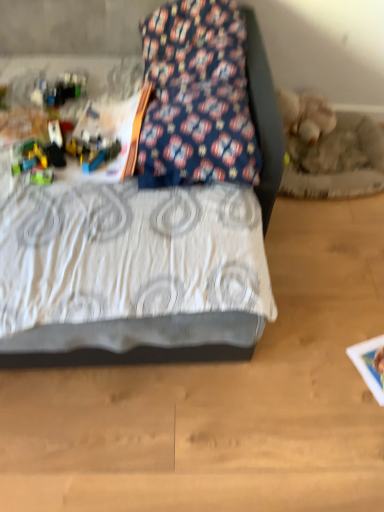
Question: Should I look upward or downward to see floral fabric pillow at upper center?

Choices:
 (A) up
 (B) down

Answer: (A)

Question: Is translucent plastic blocks at left bigger than floral fabric pillow at upper center?

Choices:
 (A) yes
 (B) no

Answer: (B)

Question: Is translucent plastic blocks at left with floral fabric pillow at upper center?

Choices:
 (A) yes
 (B) no

Answer: (B)

Question: From the image's perspective, would you say translucent plastic blocks at left is shown under floral fabric pillow at upper center?

Choices:
 (A) no
 (B) yes

Answer: (B)

Question: From the image's perspective, would you say translucent plastic blocks at left is positioned over floral fabric pillow at upper center?

Choices:
 (A) no
 (B) yes

Answer: (A)

Question: Is translucent plastic blocks at left wider than floral fabric pillow at upper center?

Choices:
 (A) yes
 (B) no

Answer: (B)

Question: Does translucent plastic blocks at left lie in front of floral fabric pillow at upper center?

Choices:
 (A) yes
 (B) no

Answer: (B)

Question: Can you confirm if white textured bed at center is shorter than translucent plastic blocks at left?

Choices:
 (A) no
 (B) yes

Answer: (A)

Question: Can you confirm if white textured bed at center is taller than translucent plastic blocks at left?

Choices:
 (A) yes
 (B) no

Answer: (A)

Question: Is white textured bed at center in contact with translucent plastic blocks at left?

Choices:
 (A) yes
 (B) no

Answer: (B)

Question: From a real-world perspective, is white textured bed at center located higher than translucent plastic blocks at left?

Choices:
 (A) yes
 (B) no

Answer: (A)

Question: Would you say white textured bed at center is a long distance from translucent plastic blocks at left?

Choices:
 (A) no
 (B) yes

Answer: (A)

Question: Does white textured bed at center come in front of translucent plastic blocks at left?

Choices:
 (A) no
 (B) yes

Answer: (B)

Question: Is floral fabric pillow at upper center beside translucent plastic blocks at left?

Choices:
 (A) yes
 (B) no

Answer: (B)